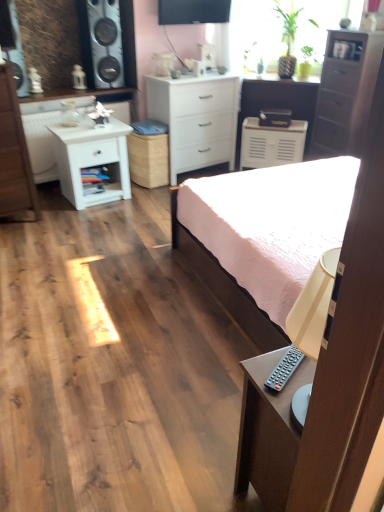
Image resolution: width=384 pixels, height=512 pixels. In order to click on white glossy cabinet at upper left in this screenshot , I will do 81,95.

What do you see at coordinates (262, 236) in the screenshot? The height and width of the screenshot is (512, 384). I see `pink fabric bed at center` at bounding box center [262, 236].

I want to click on pink fabric bed at center, so click(x=262, y=236).

What do you see at coordinates (255, 36) in the screenshot? I see `green leafy plant at upper right` at bounding box center [255, 36].

You are a GUI agent. You are given a task and a screenshot of the screen. Output one action in this format:
    pyautogui.click(x=<x>, y=<y>)
    Task: Click on the white matte chest of drawers at center, which is the second chest of drawers in right-to-left order
    This screenshot has height=512, width=384.
    Given the screenshot: What is the action you would take?
    pyautogui.click(x=196, y=119)

Where is `white matte nightstand at left`? This screenshot has width=384, height=512. white matte nightstand at left is located at coordinates (92, 160).

At what (x,y) coordinates should I click in order to perform the action: click on white glossy cabinet at upper left. Please return your answer as a coordinate pair (x, y). The width and height of the screenshot is (384, 512). Looking at the image, I should click on (81, 95).

Which of these two, white matte nightstand at left or white matte cabinet at center, is bigger?

With larger size is white matte nightstand at left.

Between white matte nightstand at left and white matte cabinet at center, which one has more height?

white matte nightstand at left.

From a real-world perspective, is white matte nightstand at left positioned above or below white matte cabinet at center?

white matte nightstand at left is above white matte cabinet at center.

Is white matte nightstand at left beside white matte cabinet at center?

They are not placed beside each other.

Based on the photo, which of these two, white glossy cabinet at upper left or white matte chest of drawers at center, which is the second chest of drawers in right-to-left order, is bigger?

white matte chest of drawers at center, which is the second chest of drawers in right-to-left order, is bigger.

Which object is further away from the camera, white glossy cabinet at upper left or white matte chest of drawers at center, which is the second chest of drawers in right-to-left order?

white matte chest of drawers at center, which is the second chest of drawers in right-to-left order.

Is white glossy cabinet at upper left to the left of white matte chest of drawers at center, which is the second chest of drawers in left-to-right order, from the viewer's perspective?

Yes.

Is white glossy cabinet at upper left in front of or behind pink fabric bed at center in the image?

Clearly, white glossy cabinet at upper left is behind pink fabric bed at center.

Does white glossy cabinet at upper left appear on the right side of pink fabric bed at center?

No.

From a real-world perspective, is white glossy cabinet at upper left over pink fabric bed at center?

Yes, from a real-world perspective, white glossy cabinet at upper left is on top of pink fabric bed at center.

How many degrees apart are the facing directions of green leafy plant at upper right and white wood chest of drawers at left, acting as the first chest of drawers starting from the left?

They differ by 52 degrees in their facing directions.

In the image, is green leafy plant at upper right positioned in front of or behind white wood chest of drawers at left, acting as the first chest of drawers starting from the left?

green leafy plant at upper right is behind white wood chest of drawers at left, acting as the first chest of drawers starting from the left.

Is white wood chest of drawers at left, acting as the first chest of drawers starting from the left, completely or partially inside green leafy plant at upper right?

No, green leafy plant at upper right does not contain white wood chest of drawers at left, acting as the first chest of drawers starting from the left.

From a real-world perspective, is green leafy plant at upper right located beneath white wood chest of drawers at left, acting as the first chest of drawers starting from the left?

Actually, green leafy plant at upper right is physically above white wood chest of drawers at left, acting as the first chest of drawers starting from the left, in the real world.

From a real-world perspective, relative to white glossy cabinet at upper left, is white wood chest of drawers at left, acting as the first chest of drawers starting from the left, vertically above or below?

In terms of real-world spatial position, white wood chest of drawers at left, acting as the first chest of drawers starting from the left, is below white glossy cabinet at upper left.

At what (x,y) coordinates should I click in order to perform the action: click on chest of drawers on the left of white glossy cabinet at upper left. Please return your answer as a coordinate pair (x, y). The image size is (384, 512). Looking at the image, I should click on (14, 153).

From the image's perspective, which one is positioned lower, white wood chest of drawers at left, which appears as the 3th chest of drawers when viewed from the right, or white glossy cabinet at upper left?

From the image's view, white wood chest of drawers at left, which appears as the 3th chest of drawers when viewed from the right, is below.

In terms of size, does white wood chest of drawers at left, which appears as the 3th chest of drawers when viewed from the right, appear bigger or smaller than white glossy cabinet at upper left?

Clearly, white wood chest of drawers at left, which appears as the 3th chest of drawers when viewed from the right, is larger in size than white glossy cabinet at upper left.

Is white matte chest of drawers at center, which is the second chest of drawers in right-to-left order, oriented away from white matte vanity at center?

No, white matte vanity at center is not at the back of white matte chest of drawers at center, which is the second chest of drawers in right-to-left order.

Which of these two, white matte chest of drawers at center, which is the second chest of drawers in right-to-left order, or white matte vanity at center, is smaller?

Smaller between the two is white matte chest of drawers at center, which is the second chest of drawers in right-to-left order.

From a real-world perspective, is white matte chest of drawers at center, which is the second chest of drawers in left-to-right order, on white matte vanity at center?

Yes, from a real-world perspective, white matte chest of drawers at center, which is the second chest of drawers in left-to-right order, is over white matte vanity at center

Between point (302, 124) and point (20, 142), which one is positioned behind?

Positioned behind is point (302, 124).

Is white matte cabinet at center beside white wood chest of drawers at left, acting as the first chest of drawers starting from the left?

No, white matte cabinet at center is not beside white wood chest of drawers at left, acting as the first chest of drawers starting from the left.

Relative to white wood chest of drawers at left, which appears as the 3th chest of drawers when viewed from the right, is white matte cabinet at center in front or behind?

In the image, white matte cabinet at center appears behind white wood chest of drawers at left, which appears as the 3th chest of drawers when viewed from the right.

Find the location of a particular element. The width and height of the screenshot is (384, 512). cabinetry located on the right of white matte nightstand at left is located at coordinates (271, 144).

Image resolution: width=384 pixels, height=512 pixels. Identify the location of counter top in front of the white matte chest of drawers at center, which is the second chest of drawers in right-to-left order. (81, 95).

Which object lies further to the anchor point white matte cabinet at center, white wood chest of drawers at left, acting as the first chest of drawers starting from the left, or white matte vanity at center?

Among the two, white wood chest of drawers at left, acting as the first chest of drawers starting from the left, is located further to white matte cabinet at center.

Estimate the real-world distances between objects in this image. Which object is closer to dark brown wooden chest of drawers at upper right, which is counted as the 1th chest of drawers, starting from the right, white wood chest of drawers at left, which appears as the 3th chest of drawers when viewed from the right, or white matte cabinet at center?

Based on the image, white matte cabinet at center appears to be nearer to dark brown wooden chest of drawers at upper right, which is counted as the 1th chest of drawers, starting from the right.

When comparing their distances from dark brown wooden chest of drawers at upper right, the 3th chest of drawers viewed from the left, does white wood chest of drawers at left, acting as the first chest of drawers starting from the left, or pink fabric bed at center seem further?

white wood chest of drawers at left, acting as the first chest of drawers starting from the left, is further to dark brown wooden chest of drawers at upper right, the 3th chest of drawers viewed from the left.

Which object lies further to the anchor point pink fabric bed at center, white matte vanity at center or white matte nightstand at left?

The object further to pink fabric bed at center is white matte vanity at center.

From the image, which object appears to be farther from white matte vanity at center, pink fabric bed at center or white matte nightstand at left?

pink fabric bed at center is further to white matte vanity at center.

Estimate the real-world distances between objects in this image. Which object is closer to pink fabric bed at center, dark brown wooden chest of drawers at upper right, which is counted as the 1th chest of drawers, starting from the right, or white glossy cabinet at upper left?

dark brown wooden chest of drawers at upper right, which is counted as the 1th chest of drawers, starting from the right.

Looking at the image, which one is located closer to white matte vanity at center, white glossy cabinet at upper left or white matte nightstand at left?

white glossy cabinet at upper left is closer to white matte vanity at center.

Looking at the image, which one is located closer to white matte nightstand at left, white glossy cabinet at upper left or white matte cabinet at center?

The object closer to white matte nightstand at left is white glossy cabinet at upper left.

Locate an element on the screen. This screenshot has height=512, width=384. speaker between white glossy cabinet at upper left and white matte vanity at center from left to right is located at coordinates (104, 42).

Where is `speaker situated between white wood chest of drawers at left, which appears as the 3th chest of drawers when viewed from the right, and pink fabric bed at center from left to right`? The width and height of the screenshot is (384, 512). speaker situated between white wood chest of drawers at left, which appears as the 3th chest of drawers when viewed from the right, and pink fabric bed at center from left to right is located at coordinates (104, 42).

What are the coordinates of `cabinetry between white wood chest of drawers at left, which appears as the 3th chest of drawers when viewed from the right, and white matte vanity at center, in the horizontal direction` in the screenshot? It's located at (271, 144).

You are a GUI agent. You are given a task and a screenshot of the screen. Output one action in this format:
    pyautogui.click(x=<x>, y=<y>)
    Task: Click on the bed between white wood chest of drawers at left, which appears as the 3th chest of drawers when viewed from the right, and green leafy plant at upper right, in the horizontal direction
    Image resolution: width=384 pixels, height=512 pixels.
    Given the screenshot: What is the action you would take?
    pyautogui.click(x=262, y=236)